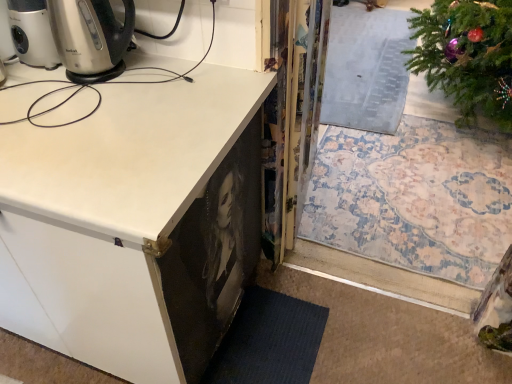
The height and width of the screenshot is (384, 512). What are the coordinates of `free space in front of transparent plastic screen door at center` in the screenshot? It's located at (342, 224).